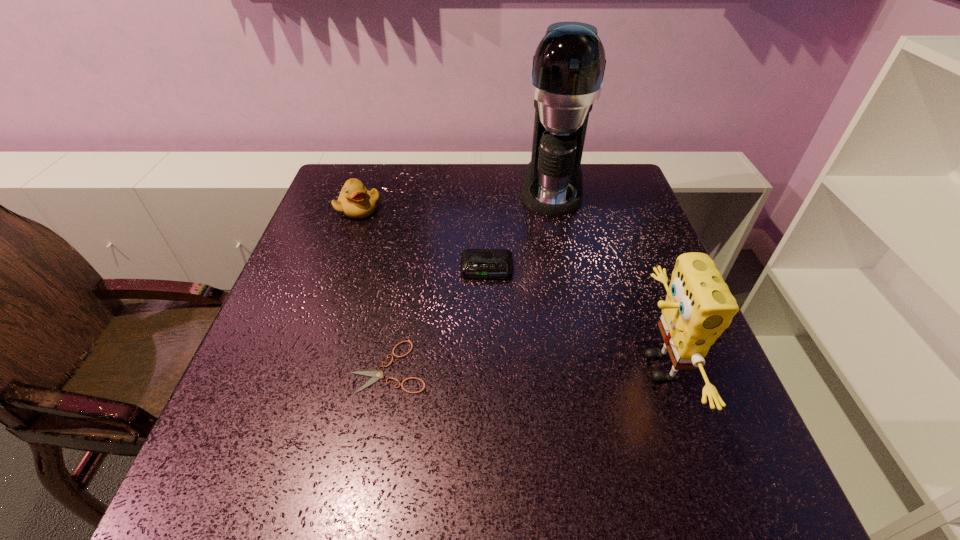
You are a GUI agent. You are given a task and a screenshot of the screen. Output one action in this format:
    pyautogui.click(x=<x>, y=<y>)
    Task: Click on the vacant space on the desktop that is between the shears and the sponge and is positioned on the display of the third object from right to left
    
    Given the screenshot: What is the action you would take?
    pyautogui.click(x=484, y=367)

In order to click on free space on the desktop that is between the shears and the second tallest object and is positioned on the front-facing side of the duckling in this screenshot , I will do `click(531, 367)`.

Find the location of `vacant space on the desktop that is between the shortest object and the sponge and is positioned place cup under the spout of the coffee maker`. vacant space on the desktop that is between the shortest object and the sponge and is positioned place cup under the spout of the coffee maker is located at coordinates (537, 367).